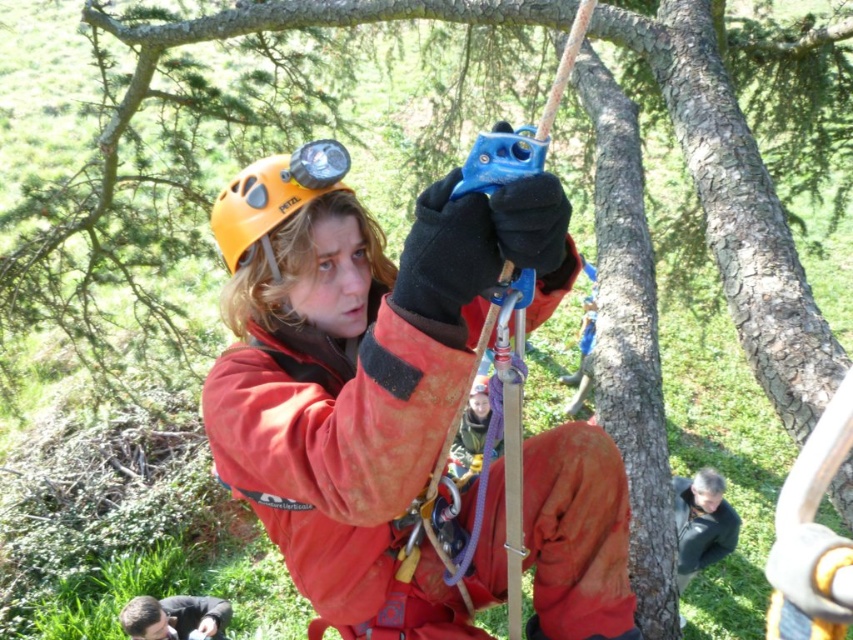
From the picture: Which is above, yellow matte helmet at center or dark green fabric at lower right?

Positioned higher is yellow matte helmet at center.

Describe the element at coordinates (273, 196) in the screenshot. I see `yellow matte helmet at center` at that location.

This screenshot has width=853, height=640. What are the coordinates of `yellow matte helmet at center` in the screenshot? It's located at (273, 196).

Image resolution: width=853 pixels, height=640 pixels. I want to click on yellow matte helmet at center, so click(273, 196).

Who is shorter, dark green fabric at lower right or dark brown leather jacket at lower left?

With less height is dark brown leather jacket at lower left.

Can you confirm if dark green fabric at lower right is bigger than dark brown leather jacket at lower left?

Indeed, dark green fabric at lower right has a larger size compared to dark brown leather jacket at lower left.

Who is more distant from viewer, (722, 540) or (212, 636)?

Point (722, 540)

The height and width of the screenshot is (640, 853). What are the coordinates of `dark green fabric at lower right` in the screenshot? It's located at (701, 522).

Between matte orange jacket at center and yellow matte helmet at center, which one has more height?

matte orange jacket at center

The image size is (853, 640). I want to click on matte orange jacket at center, so click(360, 371).

Between point (201, 403) and point (238, 186), which one is positioned behind?

The point (238, 186) is more distant.

At what (x,y) coordinates should I click in order to perform the action: click on matte orange jacket at center. Please return your answer as a coordinate pair (x, y). Looking at the image, I should click on (360, 371).